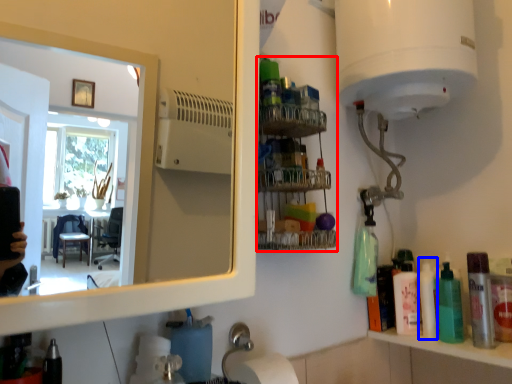
Question: Which point is further to the camera, shelf (highlighted by a red box) or cleaning product (highlighted by a blue box)?

Choices:
 (A) shelf
 (B) cleaning product

Answer: (B)